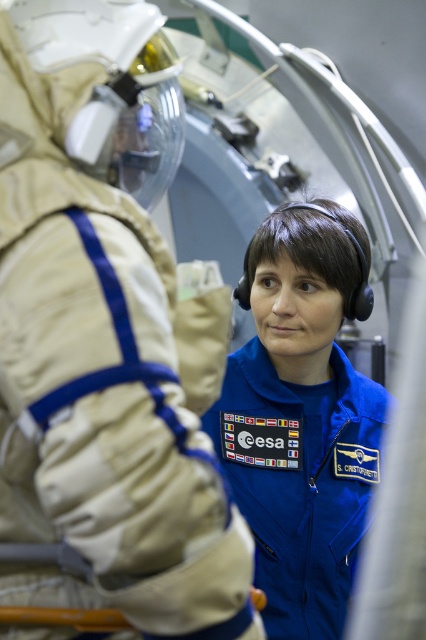
You are an astronaut in the spacecraft. You need to retrieve a tool from the storage compartment located to the right of the beige fabric spacesuit at center. Which direction should you move relative to the blue fabric astronaut suit at center?

The beige fabric spacesuit at center is to the left of the blue fabric astronaut suit at center. To reach the storage compartment to the right of the beige fabric spacesuit at center, you should move to the right side of the blue fabric astronaut suit at center.

You are an astronaut in the spacecraft and need to locate the beige fabric spacesuit at center. According to the coordinates provided, where exactly is it positioned?

The beige fabric spacesuit at center is located at the 2D coordinates point (106, 339).

You are an astronaut in the spacecraft and need to retrieve an object from the lower storage compartment. Which suit is closer to the compartment? The beige fabric spacesuit at center or the blue fabric astronaut suit at center?

The blue fabric astronaut suit at center is closer to the lower storage compartment because the beige fabric spacesuit at center is located above it.